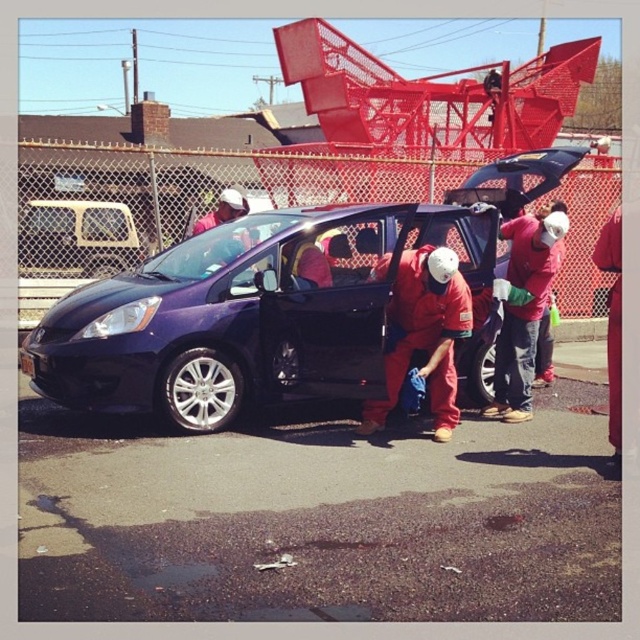
You are a safety inspector checking the equipment of workers in the scene. You notice the red matte jumpsuit at center and the matte red helmet at center. Which piece of equipment is wider?

The red matte jumpsuit at center is wider than the matte red helmet at center according to the description.

You are a photographer positioned at the edge of the parking lot. You need to capture a clear shot of both the purple matte car at center and the metallic silver minivan at left. Considering their positions, which vehicle should you focus on first to ensure both are in frame without moving your camera?

The purple matte car at center is closer to the viewer than the metallic silver minivan at left. To ensure both are in frame without moving the camera, focus on the metallic silver minivan at left first, as it is farther away and adjusting focus from far to near will help keep both in the composition.

You are standing at the point with coordinates of 0.4, 0.5. You want to walk to the red matte jumpsuit at center. In which direction should you walk?

You should walk northeast to reach the red matte jumpsuit at center located at point (424, 333) from your current position at (320, 256).